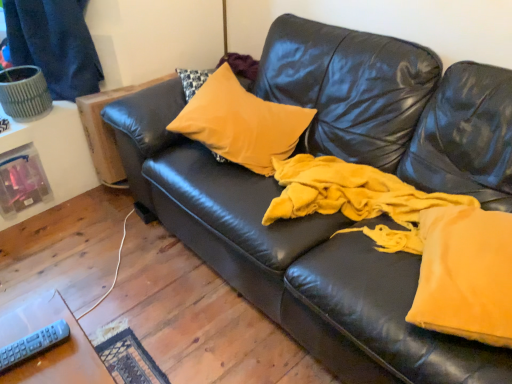
Question: From a real-world perspective, is gray plastic remote at lower left located higher than velvet yellow pillow at right, placed as the second fabric when sorted from back to front?

Choices:
 (A) yes
 (B) no

Answer: (A)

Question: Is gray plastic remote at lower left further to the viewer compared to velvet yellow pillow at right, placed as the second fabric when sorted from back to front?

Choices:
 (A) yes
 (B) no

Answer: (B)

Question: Could you tell me if gray plastic remote at lower left is facing velvet yellow pillow at right, the first fabric in the front-to-back sequence?

Choices:
 (A) yes
 (B) no

Answer: (B)

Question: Can you confirm if gray plastic remote at lower left is positioned to the left of velvet yellow pillow at right, placed as the second fabric when sorted from back to front?

Choices:
 (A) yes
 (B) no

Answer: (A)

Question: Can you confirm if gray plastic remote at lower left is wider than velvet yellow pillow at right, placed as the second fabric when sorted from back to front?

Choices:
 (A) no
 (B) yes

Answer: (A)

Question: Is gray plastic remote at lower left completely or partially outside of velvet yellow pillow at right, the first fabric in the front-to-back sequence?

Choices:
 (A) yes
 (B) no

Answer: (A)

Question: Can we say satin yellow pillow at center lies outside dark blue fabric at upper left?

Choices:
 (A) yes
 (B) no

Answer: (A)

Question: From a real-world perspective, does satin yellow pillow at center sit lower than dark blue fabric at upper left?

Choices:
 (A) no
 (B) yes

Answer: (B)

Question: From a real-world perspective, is satin yellow pillow at center on dark blue fabric at upper left?

Choices:
 (A) no
 (B) yes

Answer: (A)

Question: Does satin yellow pillow at center have a lesser width compared to dark blue fabric at upper left?

Choices:
 (A) yes
 (B) no

Answer: (B)

Question: Can you confirm if satin yellow pillow at center is wider than dark blue fabric at upper left?

Choices:
 (A) no
 (B) yes

Answer: (B)

Question: From the image's perspective, is satin yellow pillow at center below dark blue fabric at upper left?

Choices:
 (A) no
 (B) yes

Answer: (B)

Question: Could gray plastic remote at lower left be considered to be inside dark blue fabric at upper left?

Choices:
 (A) no
 (B) yes

Answer: (A)